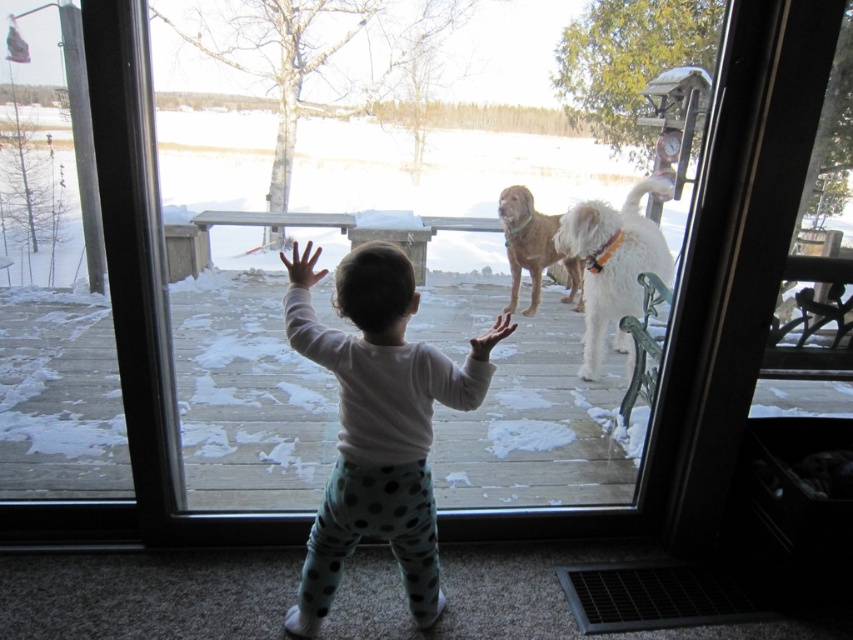
You are a parent looking through the transparent glass window at center. You see your child, the white soft toddler at center, standing on the other side. Can you touch your child through the window?

The white soft toddler at center is behind the transparent glass window at center, so you cannot touch them directly through the window.

You are standing in the living room near the glass door and want to throw a ball to the white fluffy dog at right. The ball is currently at point (613, 264). Is the ball already near the white fluffy dog at right?

Yes, the ball at point (613, 264) is already near the white fluffy dog at right because the point is located on the white fluffy dog at right.

You are a parent looking through the transparent glass window at center to check on your child. Where is the white soft toddler at center in relation to the window?

The white soft toddler at center is to the right of the transparent glass window at center because the window is to the left of the toddler.